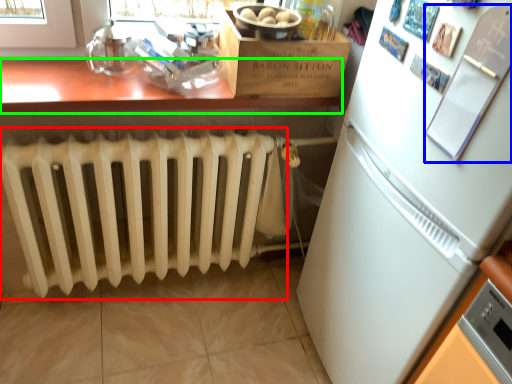
Question: Which object is the closest to the radiator (highlighted by a red box)? Choose among these: bulletin board (highlighted by a blue box) or table (highlighted by a green box).

Choices:
 (A) bulletin board
 (B) table

Answer: (B)